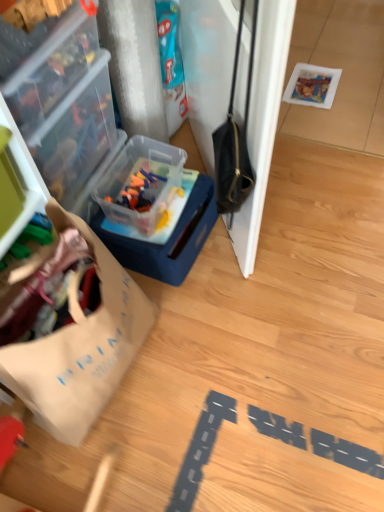
The height and width of the screenshot is (512, 384). I want to click on vacant region in front of brown paper bag at left, so click(x=112, y=465).